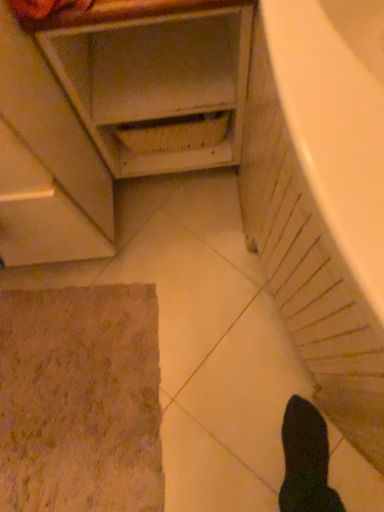
Question: Should I look upward or downward to see brown textured bath mat at lower left?

Choices:
 (A) up
 (B) down

Answer: (B)

Question: Is white glossy bathtub at lower right oriented away from brown textured bath mat at lower left?

Choices:
 (A) yes
 (B) no

Answer: (B)

Question: Can you confirm if white glossy bathtub at lower right is bigger than brown textured bath mat at lower left?

Choices:
 (A) yes
 (B) no

Answer: (A)

Question: From a real-world perspective, does white glossy bathtub at lower right sit lower than brown textured bath mat at lower left?

Choices:
 (A) yes
 (B) no

Answer: (B)

Question: Can you confirm if white glossy bathtub at lower right is smaller than brown textured bath mat at lower left?

Choices:
 (A) yes
 (B) no

Answer: (B)

Question: Could you tell me if white glossy bathtub at lower right is turned towards brown textured bath mat at lower left?

Choices:
 (A) yes
 (B) no

Answer: (A)

Question: Does white glossy bathtub at lower right come behind brown textured bath mat at lower left?

Choices:
 (A) yes
 (B) no

Answer: (B)

Question: From a real-world perspective, is white glossy bathtub at lower right on matte white cabinet at upper left?

Choices:
 (A) no
 (B) yes

Answer: (B)

Question: Considering the relative sizes of white glossy bathtub at lower right and matte white cabinet at upper left in the image provided, is white glossy bathtub at lower right taller than matte white cabinet at upper left?

Choices:
 (A) yes
 (B) no

Answer: (A)

Question: Considering the relative sizes of white glossy bathtub at lower right and matte white cabinet at upper left in the image provided, is white glossy bathtub at lower right shorter than matte white cabinet at upper left?

Choices:
 (A) no
 (B) yes

Answer: (A)

Question: From the image's perspective, is white glossy bathtub at lower right under matte white cabinet at upper left?

Choices:
 (A) no
 (B) yes

Answer: (B)

Question: Is white glossy bathtub at lower right looking in the opposite direction of matte white cabinet at upper left?

Choices:
 (A) no
 (B) yes

Answer: (A)

Question: From a real-world perspective, is white glossy bathtub at lower right positioned under matte white cabinet at upper left based on gravity?

Choices:
 (A) no
 (B) yes

Answer: (A)

Question: Is matte white cabinet at upper left smaller than brown textured bath mat at lower left?

Choices:
 (A) no
 (B) yes

Answer: (A)